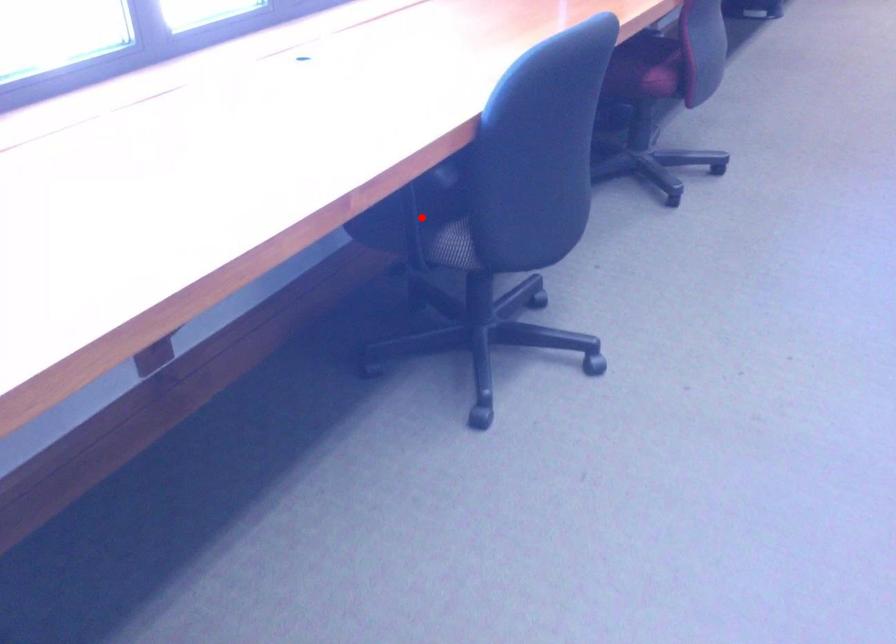
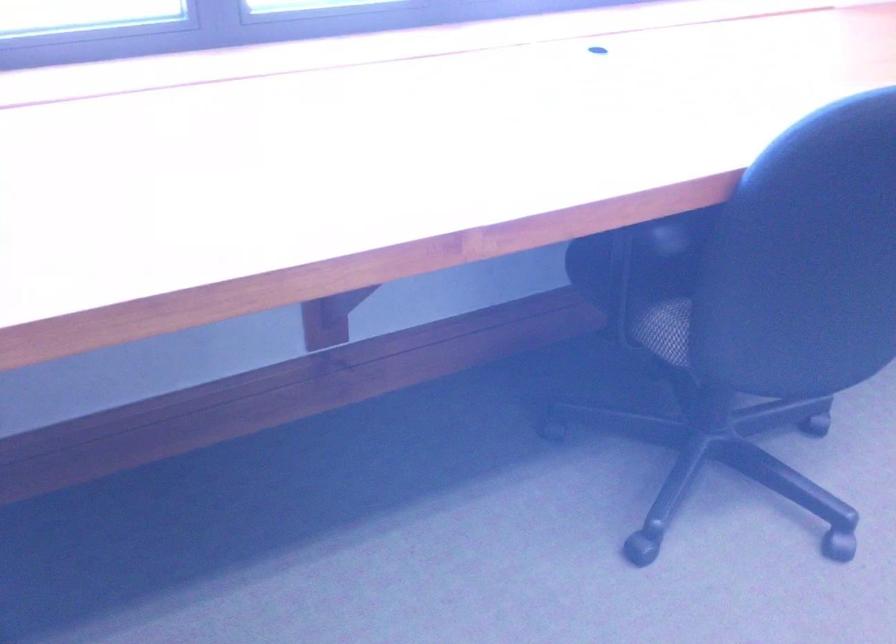
The point at the highlighted location is marked in the first image. Where is the corresponding point in the second image?

(645, 279)